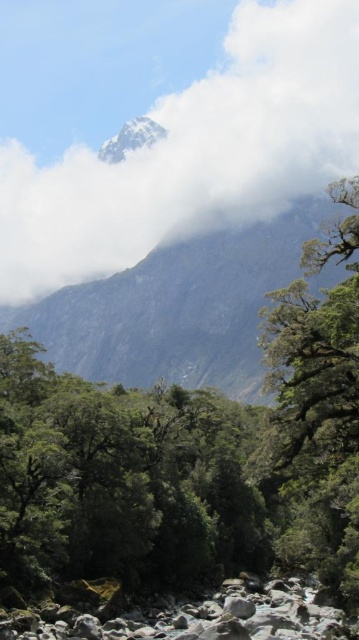
Does white fluffy cloud at upper center have a smaller size compared to rocky gray mountain at upper center?

Actually, white fluffy cloud at upper center might be larger than rocky gray mountain at upper center.

Who is more forward, (146, 188) or (202, 346)?

Positioned in front is point (202, 346).

The width and height of the screenshot is (359, 640). Find the location of `white fluffy cloud at upper center`. white fluffy cloud at upper center is located at coordinates (194, 152).